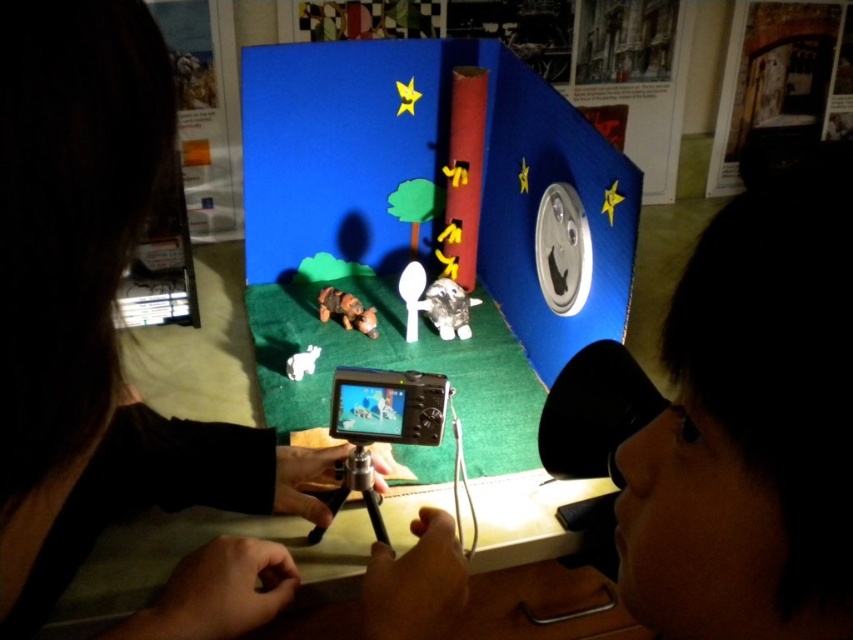
Question: Can you confirm if black matte camera at center is smaller than matte plastic video game at center?

Choices:
 (A) no
 (B) yes

Answer: (A)

Question: Is black matte camera at center further to the viewer compared to matte plastic video game at center?

Choices:
 (A) yes
 (B) no

Answer: (B)

Question: Can you confirm if black matte camera at center is positioned below matte plastic video game at center?

Choices:
 (A) yes
 (B) no

Answer: (B)

Question: Among these objects, which one is farthest from the camera?

Choices:
 (A) matte plastic video game at center
 (B) black matte camera at center

Answer: (A)